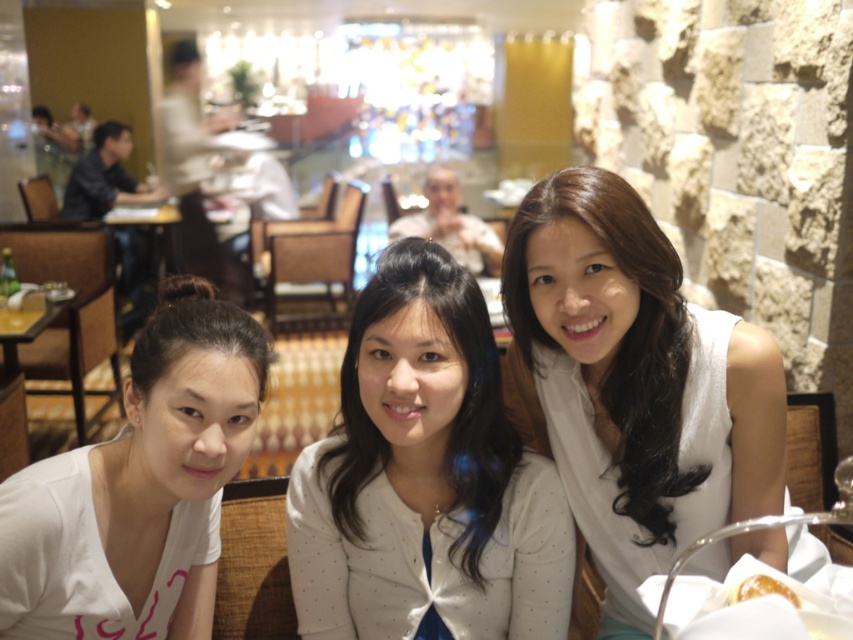
Question: Which point is closer to the camera?

Choices:
 (A) (735, 589)
 (B) (643, 243)
 (C) (335, 474)
 (D) (223, 440)

Answer: (A)

Question: Which point appears farthest from the camera in this image?

Choices:
 (A) (175, 588)
 (B) (767, 589)
 (C) (520, 348)
 (D) (387, 612)

Answer: (C)

Question: Is white matte dress at center thinner than white matte shirt at left?

Choices:
 (A) no
 (B) yes

Answer: (A)

Question: Is white matte shirt at left positioned before golden glazed donut at lower right?

Choices:
 (A) no
 (B) yes

Answer: (A)

Question: Is white matte dress at center above white dotted cardigan at center?

Choices:
 (A) no
 (B) yes

Answer: (B)

Question: Which point appears closest to the camera in this image?

Choices:
 (A) (486, 506)
 (B) (167, 330)
 (C) (573, 324)

Answer: (B)